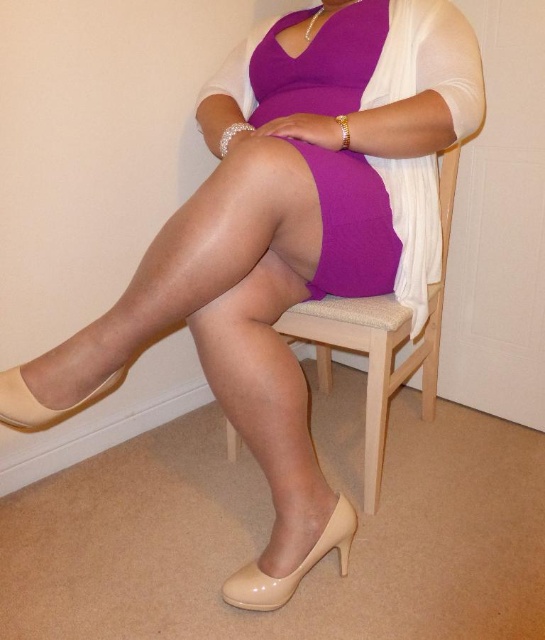
Question: Among these objects, which one is nearest to the camera?

Choices:
 (A) purple matte dress at center
 (B) sheer beige tights at center
 (C) matte beige high-heeled shoe at lower left
 (D) matte beige high-heeled shoe at lower center

Answer: (B)

Question: Which of the following is the farthest from the observer?

Choices:
 (A) (366, 394)
 (B) (135, 316)
 (C) (342, 232)

Answer: (A)

Question: Does matte beige pantyhose at center appear on the left side of purple matte dress at center?

Choices:
 (A) no
 (B) yes

Answer: (B)

Question: Can you confirm if beige wood chair at center is positioned to the left of matte beige high-heeled shoe at lower center?

Choices:
 (A) yes
 (B) no

Answer: (B)

Question: Is sheer beige tights at center below matte beige high-heeled shoe at lower left?

Choices:
 (A) yes
 (B) no

Answer: (B)

Question: Estimate the real-world distances between objects in this image. Which object is farther from the sheer beige tights at center?

Choices:
 (A) matte beige pantyhose at center
 (B) matte beige high-heeled shoe at lower left
 (C) purple matte dress at center
 (D) matte beige high-heeled shoe at lower center

Answer: (D)